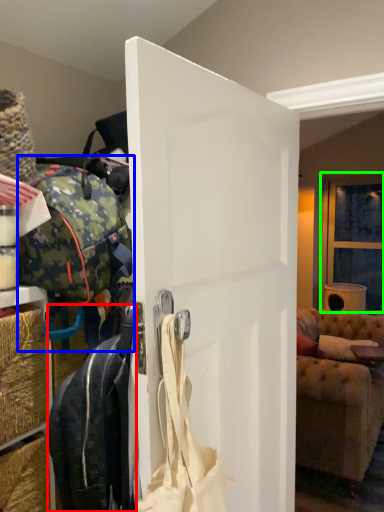
Question: Which object is positioned farthest from luggage and bags (highlighted by a red box)? Select from luggage and bags (highlighted by a blue box) and window (highlighted by a green box).

Choices:
 (A) luggage and bags
 (B) window

Answer: (B)